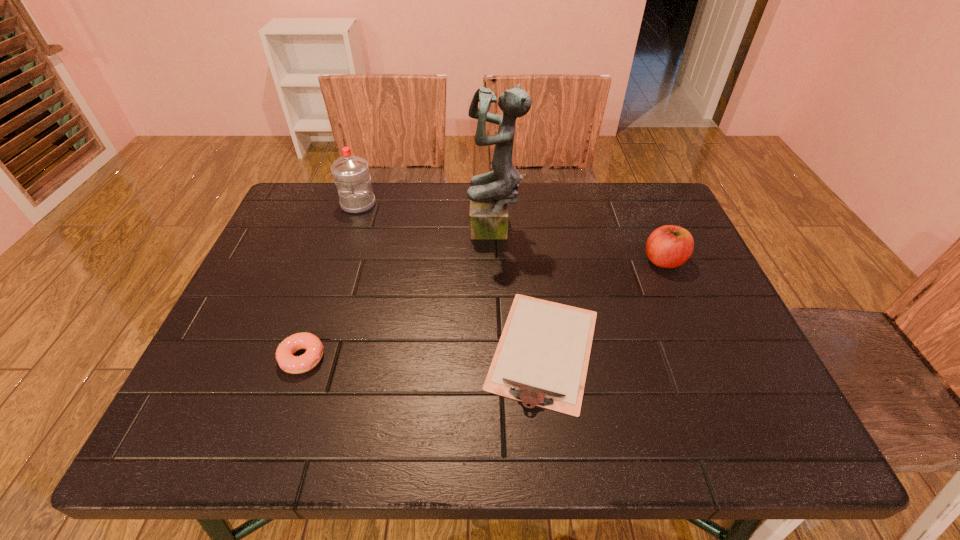
Locate an element on the screen. The height and width of the screenshot is (540, 960). vacant position in the image that satisfies the following two spatial constraints: 1. on the face of the tallest object; 2. on the left side of the apple is located at coordinates (496, 261).

Where is `free region that satisfies the following two spatial constraints: 1. on the handle side of the shortest object; 2. on the left side of the second tallest object`? This screenshot has width=960, height=540. free region that satisfies the following two spatial constraints: 1. on the handle side of the shortest object; 2. on the left side of the second tallest object is located at coordinates (311, 349).

Find the location of a particular element. The width and height of the screenshot is (960, 540). blank space that satisfies the following two spatial constraints: 1. on the back side of the second shortest object; 2. on the left side of the third shortest object is located at coordinates (335, 261).

At what (x,y) coordinates should I click in order to perform the action: click on vacant area that satisfies the following two spatial constraints: 1. on the handle side of the shortest object; 2. on the left side of the farthest object. Please return your answer as a coordinate pair (x, y). Looking at the image, I should click on (311, 349).